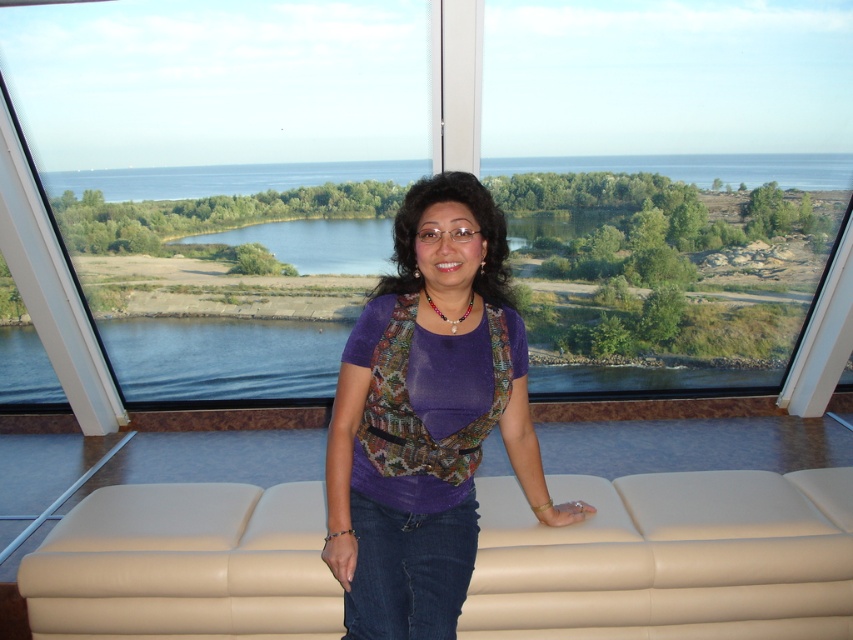
Between beige leather couch at lower center and purple fabric top at center, which one has less height?

Standing shorter between the two is beige leather couch at lower center.

You are a GUI agent. You are given a task and a screenshot of the screen. Output one action in this format:
    pyautogui.click(x=<x>, y=<y>)
    Task: Click on the beige leather couch at lower center
    
    Given the screenshot: What is the action you would take?
    pyautogui.click(x=668, y=557)

Is point (488, 81) farther from camera compared to point (834, 500)?

That is True.

Does point (727, 276) come farther from viewer compared to point (625, 588)?

Yes, it is.

Where is `transparent glass window at center`? transparent glass window at center is located at coordinates click(x=447, y=168).

How much distance is there between transparent glass window at center and purple fabric top at center?

transparent glass window at center and purple fabric top at center are 16.10 feet apart.

Locate an element on the screen. The height and width of the screenshot is (640, 853). transparent glass window at center is located at coordinates (447, 168).

This screenshot has width=853, height=640. Find the location of `transparent glass window at center`. transparent glass window at center is located at coordinates (x=447, y=168).